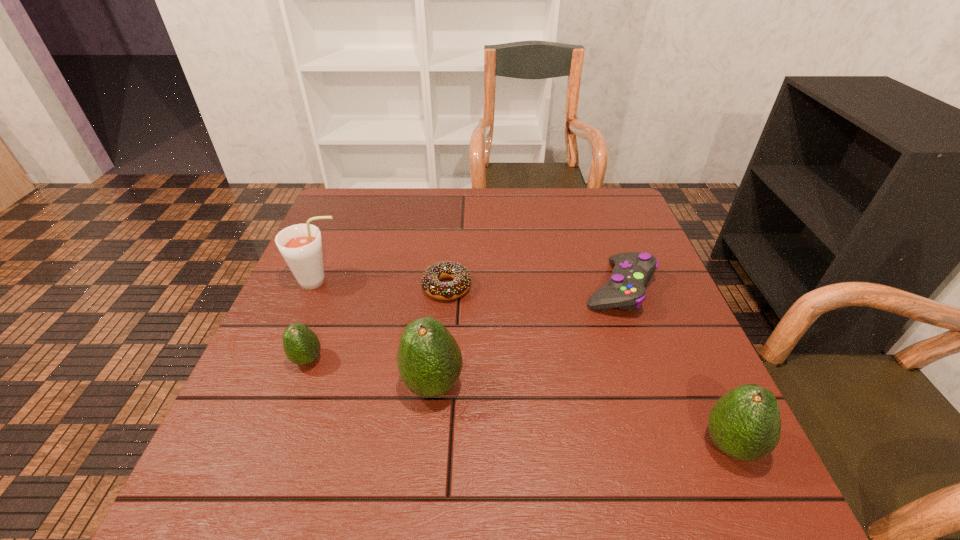
What are the coordinates of `vacant region between the third shortest object and the second avocado from left to right` in the screenshot? It's located at (371, 373).

Where is `empty location between the fourth shortest object and the second avocado from right to left`? empty location between the fourth shortest object and the second avocado from right to left is located at coordinates (582, 415).

The height and width of the screenshot is (540, 960). What are the coordinates of `free space between the shortest object and the root beer` in the screenshot? It's located at (383, 284).

You are a GUI agent. You are given a task and a screenshot of the screen. Output one action in this format:
    pyautogui.click(x=<x>, y=<y>)
    Task: Click on the vacant area that lies between the doughnut and the root beer
    This screenshot has width=960, height=540.
    Given the screenshot: What is the action you would take?
    pyautogui.click(x=383, y=284)

Identify the location of object that is the third closest to the nearest avocado. The height and width of the screenshot is (540, 960). (431, 285).

Identify which object is the nearest to the shortest object. Please provide its 2D coordinates. Your answer should be formatted as a tuple, i.e. [(x, y)], where the tuple contains the x and y coordinates of a point satisfying the conditions above.

[(429, 359)]

Find the location of `the closest avocado to the control`. the closest avocado to the control is located at coordinates (745, 424).

Where is `the closest avocado to the second avocado from left to right`? This screenshot has width=960, height=540. the closest avocado to the second avocado from left to right is located at coordinates (301, 345).

Where is `vacant region that satisfies the following two spatial constraints: 1. on the drink side of the shortest object; 2. on the left side of the root beer`? The width and height of the screenshot is (960, 540). vacant region that satisfies the following two spatial constraints: 1. on the drink side of the shortest object; 2. on the left side of the root beer is located at coordinates (317, 287).

I want to click on vacant area that satisfies the following two spatial constraints: 1. on the drink side of the second shortest object; 2. on the left side of the root beer, so click(316, 288).